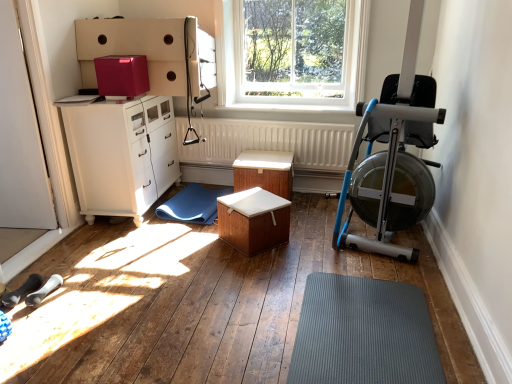
Question: Is white glossy cabinet at left situated inside silver metallic rowing machine at right or outside?

Choices:
 (A) inside
 (B) outside

Answer: (B)

Question: Is white glossy cabinet at left bigger or smaller than silver metallic rowing machine at right?

Choices:
 (A) small
 (B) big

Answer: (A)

Question: Considering the real-world distances, which object is farthest from the glossy cardboard box at upper center?

Choices:
 (A) wooden table at center, which is the first table from back to front
 (B) silver metallic rowing machine at right
 (C) wooden box at center, acting as the 1th table starting from the front
 (D) clear glass window at upper center
 (E) gray rubber mat at lower center, the first doormat positioned from the front

Answer: (E)

Question: Estimate the real-world distances between objects in this image. Which object is closer to the white glossy cabinet at left?

Choices:
 (A) wooden box at center, the 2th table positioned from the back
 (B) silver metallic rowing machine at right
 (C) white textured radiator at center
 (D) clear glass window at upper center
 (E) gray rubber mat at lower center, the first doormat positioned from the right

Answer: (C)